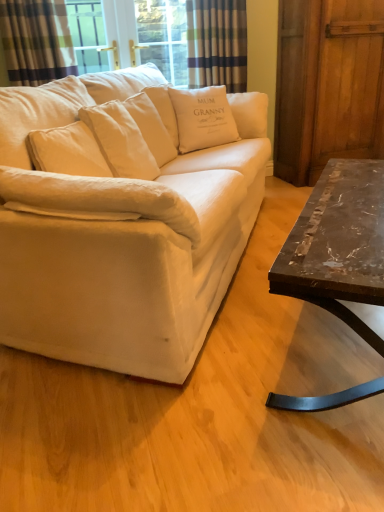
This screenshot has height=512, width=384. What do you see at coordinates (36, 41) in the screenshot? I see `plaid fabric curtain at upper left, placed as the 2th curtain when sorted from right to left` at bounding box center [36, 41].

Locate an element on the screen. plaid fabric curtain at upper center, the 1th curtain positioned from the right is located at coordinates (217, 42).

Identify the location of white cotton couch at center. The image size is (384, 512). (123, 219).

Which is more to the right, white cotton cushion at center, positioned as the 1th pillow in right-to-left order, or marble/black metal coffee table at right?

marble/black metal coffee table at right.

Can you confirm if white cotton cushion at center, positioned as the 1th pillow in right-to-left order, is thinner than marble/black metal coffee table at right?

In fact, white cotton cushion at center, positioned as the 1th pillow in right-to-left order, might be wider than marble/black metal coffee table at right.

Who is bigger, white cotton cushion at center, which is the 2th pillow from left to right, or marble/black metal coffee table at right?

marble/black metal coffee table at right.

Based on their positions, is plaid fabric curtain at upper center, the second curtain from the left, located to the left or right of wooden barn door at right?

Clearly, plaid fabric curtain at upper center, the second curtain from the left, is on the left of wooden barn door at right in the image.

Would you say plaid fabric curtain at upper center, the first curtain when ordered from back to front, is outside wooden barn door at right?

Indeed, plaid fabric curtain at upper center, the first curtain when ordered from back to front, is completely outside wooden barn door at right.

The height and width of the screenshot is (512, 384). In the image, there is a plaid fabric curtain at upper center, the second curtain from the left. In order to click on barn door below it (from a real-world perspective) in this screenshot , I will do `click(328, 85)`.

Is the depth of plaid fabric curtain at upper center, the second curtain from the left, less than that of wooden barn door at right?

No, the depth of plaid fabric curtain at upper center, the second curtain from the left, is greater than that of wooden barn door at right.

Is plaid fabric curtain at upper center, the 1th curtain positioned from the right, spatially inside white cotton couch at center, or outside of it?

plaid fabric curtain at upper center, the 1th curtain positioned from the right, is not enclosed by white cotton couch at center.

Considering the positions of point (221, 3) and point (227, 211), is point (221, 3) closer or farther from the camera than point (227, 211)?

Point (221, 3) is positioned farther from the camera compared to point (227, 211).

How far apart are plaid fabric curtain at upper center, the 1th curtain positioned from the right, and white cotton couch at center?

plaid fabric curtain at upper center, the 1th curtain positioned from the right, is 3.50 feet from white cotton couch at center.

From the image's perspective, count 1st curtains upward from the wooden barn door at right and point to it. Please provide its 2D coordinates.

[(36, 41)]

Between wooden barn door at right and plaid fabric curtain at upper left, placed as the 2th curtain when sorted from right to left, which one has larger width?

Wider between the two is wooden barn door at right.

From a real-world perspective, is wooden barn door at right physically below plaid fabric curtain at upper left, which is the 1th curtain from front to back?

Yes, from a real-world perspective, wooden barn door at right is under plaid fabric curtain at upper left, which is the 1th curtain from front to back.

Does point (306, 139) come closer to viewer compared to point (14, 58)?

No, it is not.

Is white cotton cushion at center, the 1th pillow positioned from the left, inside white cotton cushion at center, positioned as the 1th pillow in right-to-left order?

Yes, white cotton cushion at center, the 1th pillow positioned from the left, is a part of white cotton cushion at center, positioned as the 1th pillow in right-to-left order.

Who is taller, white cotton cushion at center, which is the 2th pillow from left to right, or white cotton cushion at center, the 1th pillow positioned from the left?

white cotton cushion at center, which is the 2th pillow from left to right, is taller.

Based on the photo, is white cotton cushion at center, which is the 2th pillow from left to right, positioned with its back to plaid fabric curtain at upper center, marked as the second curtain in a front-to-back arrangement?

No.

Is white cotton cushion at center, positioned as the 1th pillow in right-to-left order, to the left or to the right of plaid fabric curtain at upper center, the second curtain from the left, in the image?

From the image, it's evident that white cotton cushion at center, positioned as the 1th pillow in right-to-left order, is to the left of plaid fabric curtain at upper center, the second curtain from the left.

Could plaid fabric curtain at upper center, marked as the second curtain in a front-to-back arrangement, be considered to be inside white cotton cushion at center, positioned as the 1th pillow in right-to-left order?

No, plaid fabric curtain at upper center, marked as the second curtain in a front-to-back arrangement, is located outside of white cotton cushion at center, positioned as the 1th pillow in right-to-left order.

Is white cotton cushion at center, which is the 2th pillow from left to right, beside plaid fabric curtain at upper center, the 1th curtain positioned from the right?

white cotton cushion at center, which is the 2th pillow from left to right, and plaid fabric curtain at upper center, the 1th curtain positioned from the right, are not in contact.

From the image's perspective, would you say plaid fabric curtain at upper left, which appears as the 2th curtain when viewed from the back, is shown under white cotton couch at center?

Incorrect, from the image's perspective, plaid fabric curtain at upper left, which appears as the 2th curtain when viewed from the back, is higher than white cotton couch at center.

Considering the relative sizes of plaid fabric curtain at upper left, which appears as the 2th curtain when viewed from the back, and white cotton couch at center in the image provided, is plaid fabric curtain at upper left, which appears as the 2th curtain when viewed from the back, thinner than white cotton couch at center?

Correct, the width of plaid fabric curtain at upper left, which appears as the 2th curtain when viewed from the back, is less than that of white cotton couch at center.

You are a GUI agent. You are given a task and a screenshot of the screen. Output one action in this format:
    pyautogui.click(x=<x>, y=<y>)
    Task: Click on the 1st curtain above when counting from the white cotton couch at center (from the image's perspective)
    
    Given the screenshot: What is the action you would take?
    pyautogui.click(x=36, y=41)

Is plaid fabric curtain at upper left, placed as the 2th curtain when sorted from right to left, situated inside white cotton couch at center or outside?

plaid fabric curtain at upper left, placed as the 2th curtain when sorted from right to left, exists outside the volume of white cotton couch at center.

From a real-world perspective, which pillow is the 1st one above the marble/black metal coffee table at right? Please provide its 2D coordinates.

[(203, 118)]

Identify the location of barn door that appears below the plaid fabric curtain at upper center, the 1th curtain positioned from the right (from the image's perspective). The height and width of the screenshot is (512, 384). (328, 85).

Looking at the image, which one is located closer to white cotton cushion at center, the 1th pillow positioned from the left, plaid fabric curtain at upper center, the 1th curtain positioned from the right, or wooden barn door at right?

plaid fabric curtain at upper center, the 1th curtain positioned from the right, lies closer to white cotton cushion at center, the 1th pillow positioned from the left, than the other object.

When comparing their distances from white cotton cushion at center, the 1th pillow positioned from the left, does plaid fabric curtain at upper left, placed as the 2th curtain when sorted from right to left, or white cotton cushion at center, which is the 2th pillow from left to right, seem further?

Among the two, plaid fabric curtain at upper left, placed as the 2th curtain when sorted from right to left, is located further to white cotton cushion at center, the 1th pillow positioned from the left.

Estimate the real-world distances between objects in this image. Which object is closer to plaid fabric curtain at upper center, the 1th curtain positioned from the right, marble/black metal coffee table at right or white cotton couch at center?

white cotton couch at center is positioned closer to the anchor plaid fabric curtain at upper center, the 1th curtain positioned from the right.

Which object lies nearer to the anchor point plaid fabric curtain at upper left, which is the 1th curtain from front to back, wooden barn door at right or marble/black metal coffee table at right?

The object closer to plaid fabric curtain at upper left, which is the 1th curtain from front to back, is wooden barn door at right.

When comparing their distances from wooden barn door at right, does white cotton cushion at center, the 1th pillow positioned from the left, or white cotton cushion at center, which is the 2th pillow from left to right, seem closer?

white cotton cushion at center, which is the 2th pillow from left to right.

Looking at the image, which one is located further to white cotton cushion at center, the 1th pillow positioned from the left, plaid fabric curtain at upper left, the first curtain when ordered from left to right, or white cotton couch at center?

plaid fabric curtain at upper left, the first curtain when ordered from left to right, is positioned further to the anchor white cotton cushion at center, the 1th pillow positioned from the left.

From the image, which object appears to be nearer to plaid fabric curtain at upper center, the 1th curtain positioned from the right, white cotton couch at center or marble/black metal coffee table at right?

white cotton couch at center is positioned closer to the anchor plaid fabric curtain at upper center, the 1th curtain positioned from the right.

Based on their spatial positions, is white cotton couch at center or plaid fabric curtain at upper left, which is the 1th curtain from front to back, further from white cotton cushion at center, which is the 2th pillow from left to right?

plaid fabric curtain at upper left, which is the 1th curtain from front to back, lies further to white cotton cushion at center, which is the 2th pillow from left to right, than the other object.

Locate an element on the screen. The height and width of the screenshot is (512, 384). pillow between white cotton couch at center and white cotton cushion at center, which is the 2th pillow from left to right, from front to back is located at coordinates (151, 127).

I want to click on studio couch between plaid fabric curtain at upper left, placed as the 2th curtain when sorted from right to left, and wooden barn door at right, so click(x=123, y=219).

Where is `curtain between white cotton cushion at center, positioned as the 1th pillow in right-to-left order, and wooden barn door at right from left to right`? This screenshot has width=384, height=512. curtain between white cotton cushion at center, positioned as the 1th pillow in right-to-left order, and wooden barn door at right from left to right is located at coordinates (217, 42).

The image size is (384, 512). What are the coordinates of `coffee table between white cotton couch at center and white cotton cushion at center, positioned as the 1th pillow in right-to-left order, along the z-axis` in the screenshot? It's located at (338, 244).